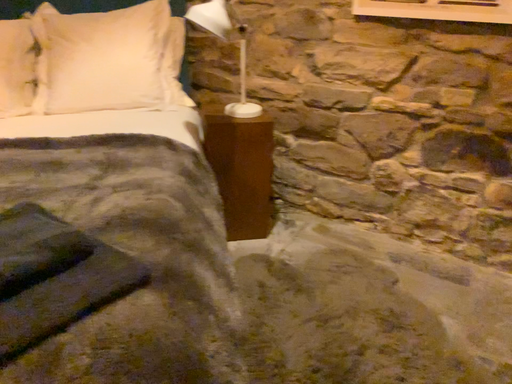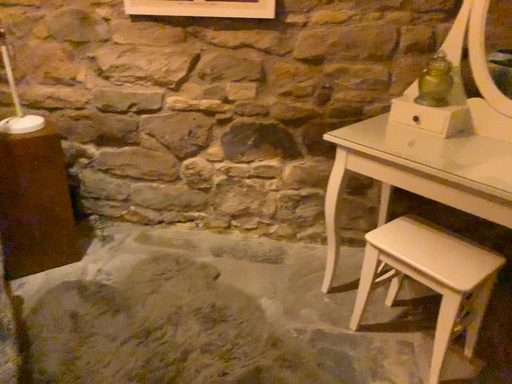
Question: How did the camera likely rotate when shooting the video?

Choices:
 (A) rotated right
 (B) rotated left

Answer: (A)